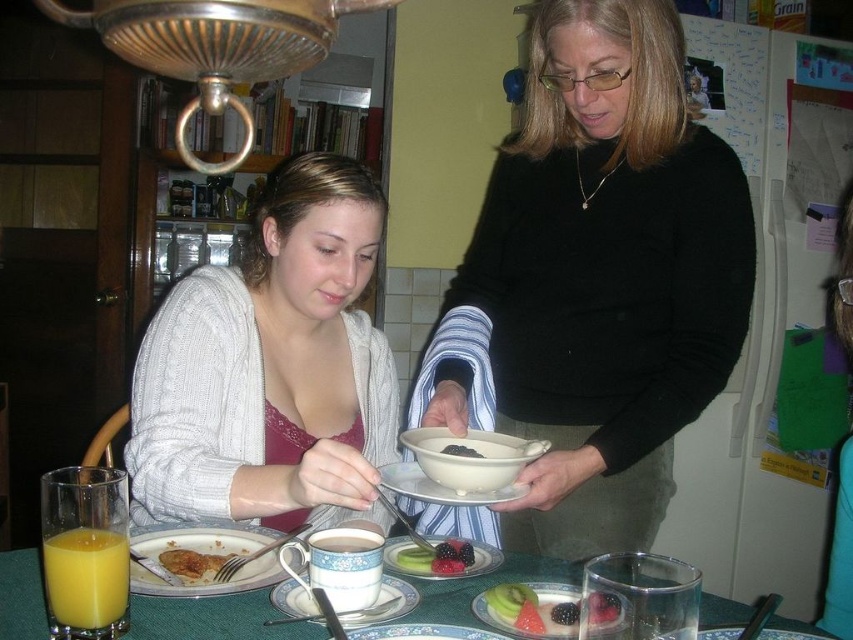
Does golden fried chicken at plate center have a larger size compared to matte ceramic mug at center?

No.

Does point (171, 572) come farther from viewer compared to point (314, 532)?

No, it is not.

Is point (234, 554) closer to camera compared to point (363, 541)?

No.

You are a GUI agent. You are given a task and a screenshot of the screen. Output one action in this format:
    pyautogui.click(x=<x>, y=<y>)
    Task: Click on the golden fried chicken at plate center
    Image resolution: width=853 pixels, height=640 pixels.
    Given the screenshot: What is the action you would take?
    pyautogui.click(x=193, y=563)

Is matte ceramic plate at center above matte ceramic mug at center?

No, matte ceramic plate at center is not above matte ceramic mug at center.

Does point (390, 540) come behind point (316, 547)?

Yes.

Image resolution: width=853 pixels, height=640 pixels. What are the coordinates of `matte ceramic plate at center` in the screenshot? It's located at (428, 564).

Is black matte sweater at center to the right of white ceramic plate at center from the viewer's perspective?

Correct, you'll find black matte sweater at center to the right of white ceramic plate at center.

Is point (734, 168) behind point (402, 465)?

Yes, point (734, 168) is farther from viewer.

Image resolution: width=853 pixels, height=640 pixels. I want to click on black matte sweater at center, so click(596, 280).

Find the location of a particular element. The image size is (853, 640). black matte sweater at center is located at coordinates (596, 280).